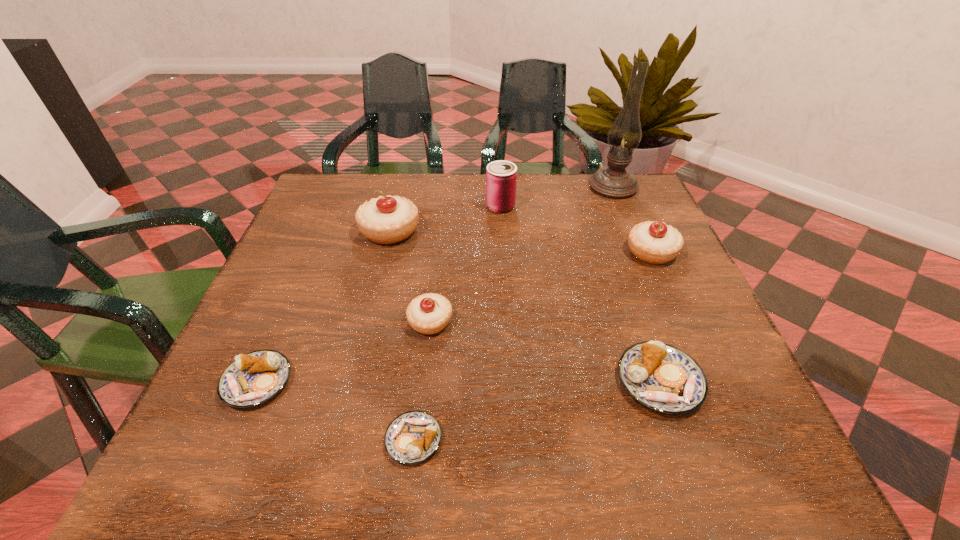
Where is `free space located 0.240m on the right of the fourth nearest pastry`? The height and width of the screenshot is (540, 960). free space located 0.240m on the right of the fourth nearest pastry is located at coordinates (572, 322).

Where is `free space located 0.370m on the left of the biggest brown pastry`? The image size is (960, 540). free space located 0.370m on the left of the biggest brown pastry is located at coordinates (408, 381).

Identify the location of vacant space located on the front of the second shortest object. The width and height of the screenshot is (960, 540). (227, 453).

Where is `free spot located on the right of the second brown pastry from right to left`? This screenshot has height=540, width=960. free spot located on the right of the second brown pastry from right to left is located at coordinates point(574,440).

In order to click on oil lamp that is at the far edge in this screenshot , I will do `click(613, 181)`.

At what (x,y) coordinates should I click in order to perform the action: click on can that is at the far edge. Please return your answer as a coordinate pair (x, y). Image resolution: width=960 pixels, height=540 pixels. Looking at the image, I should click on (501, 176).

Image resolution: width=960 pixels, height=540 pixels. Identify the location of pastry present at the far edge. (391, 219).

You are a GUI agent. You are given a task and a screenshot of the screen. Output one action in this format:
    pyautogui.click(x=<x>, y=<y>)
    Task: Click on the object positioned at the near edge
    
    Given the screenshot: What is the action you would take?
    pyautogui.click(x=413, y=437)

Find the location of a particular element. object that is at the left edge is located at coordinates (252, 379).

You are a GUI agent. You are given a task and a screenshot of the screen. Output one action in this format:
    pyautogui.click(x=<x>, y=<y>)
    Task: Click on the oil lamp located in the right edge section of the desktop
    This screenshot has height=540, width=960.
    Given the screenshot: What is the action you would take?
    pyautogui.click(x=613, y=181)